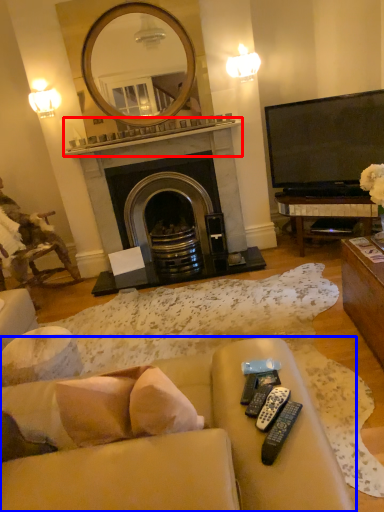
Question: Which object appears closest to the camera in this image, mantle (highlighted by a red box) or studio couch (highlighted by a blue box)?

Choices:
 (A) mantle
 (B) studio couch

Answer: (B)